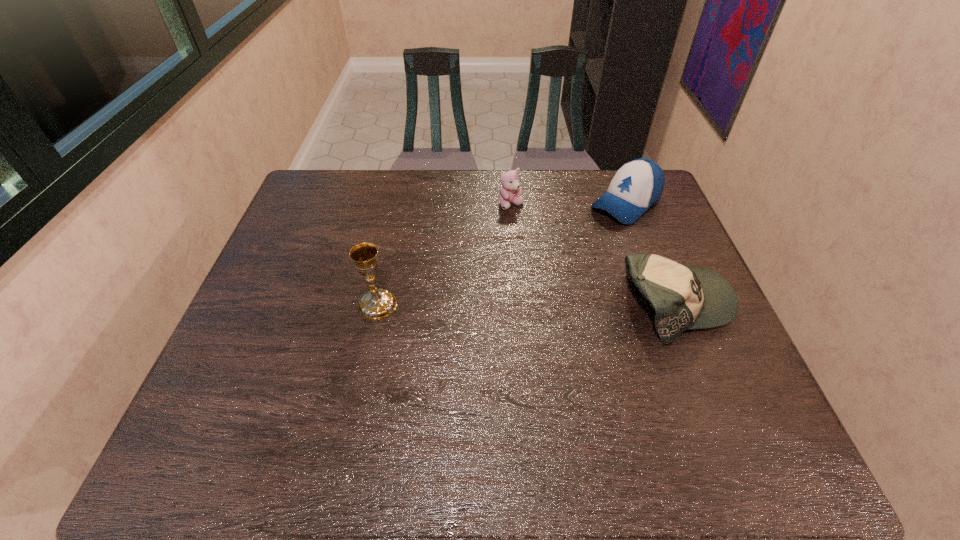
You are a GUI agent. You are given a task and a screenshot of the screen. Output one action in this format:
    pyautogui.click(x=<x>, y=<y>)
    Task: Click on the vacant space that's between the nearer baseball cap and the chalice
    This screenshot has width=960, height=540.
    Given the screenshot: What is the action you would take?
    pyautogui.click(x=527, y=305)

Find the location of a particular element. The image size is (960, 540). blank region between the chalice and the second object from left to right is located at coordinates (444, 255).

The image size is (960, 540). I want to click on vacant space in between the farther baseball cap and the second object from left to right, so click(x=568, y=205).

The width and height of the screenshot is (960, 540). Find the location of `free space between the teddy bear and the tallest object`. free space between the teddy bear and the tallest object is located at coordinates (444, 255).

Where is `empty space between the nearer baseball cap and the leftmost object`? The image size is (960, 540). empty space between the nearer baseball cap and the leftmost object is located at coordinates (527, 305).

Locate an element on the screen. Image resolution: width=960 pixels, height=540 pixels. free space between the shorter baseball cap and the leftmost object is located at coordinates (527, 305).

Identify the location of vacant space in between the leftmost object and the shorter baseball cap. The height and width of the screenshot is (540, 960). (527, 305).

Identify which object is the second closest to the nearer baseball cap. Please provide its 2D coordinates. Your answer should be formatted as a tuple, i.e. [(x, y)], where the tuple contains the x and y coordinates of a point satisfying the conditions above.

[(509, 191)]

Where is `object identified as the third closest to the shorter baseball cap`? The width and height of the screenshot is (960, 540). object identified as the third closest to the shorter baseball cap is located at coordinates (377, 304).

Image resolution: width=960 pixels, height=540 pixels. In order to click on blank area in the image that satisfies the following two spatial constraints: 1. on the back side of the third object from right to left; 2. on the left side of the leftmost object in this screenshot , I will do `click(398, 205)`.